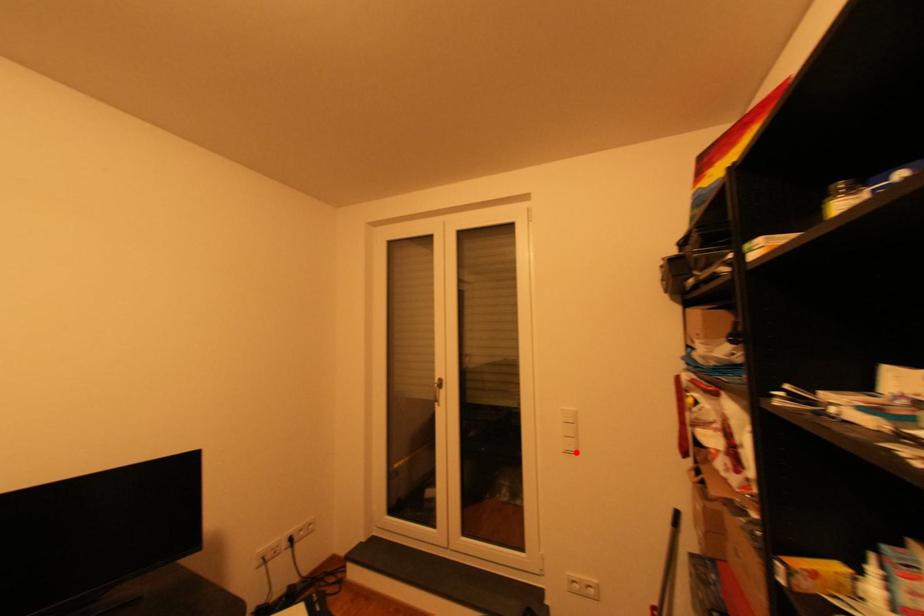
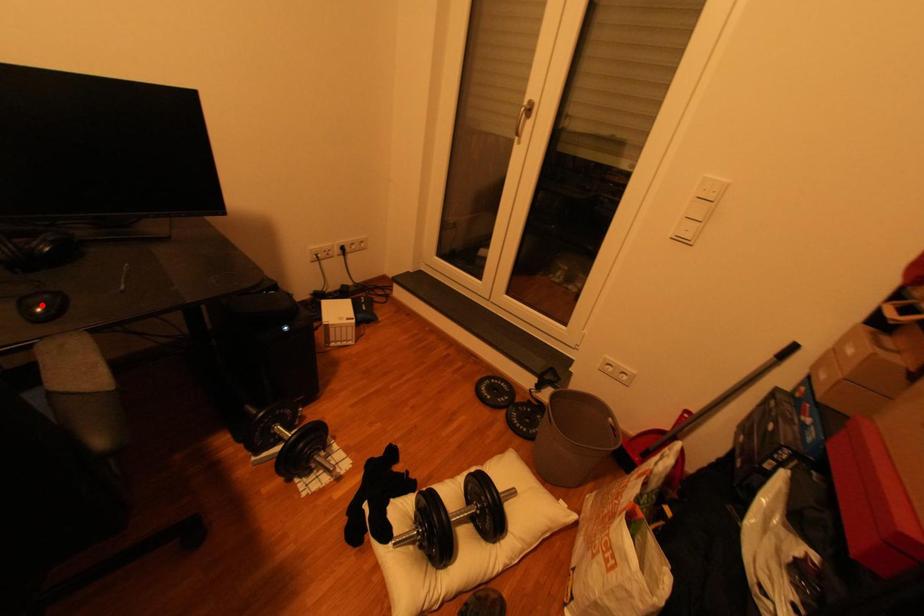
I am providing you with two images of the same scene from different viewpoints. A red point is marked on the first image and another point is marked on the second image. Is the marked point in image1 the same physical position as the marked point in image2?

No